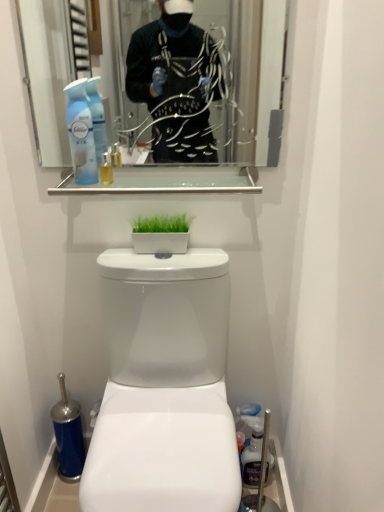
Question: Does white glossy toilet at center have a greater height compared to white glossy planter at center?

Choices:
 (A) no
 (B) yes

Answer: (B)

Question: Is white glossy toilet at center wider than white glossy planter at center?

Choices:
 (A) no
 (B) yes

Answer: (B)

Question: Is white glossy toilet at center facing away from white glossy planter at center?

Choices:
 (A) yes
 (B) no

Answer: (B)

Question: Is white glossy toilet at center placed right next to white glossy planter at center?

Choices:
 (A) yes
 (B) no

Answer: (B)

Question: Is white glossy toilet at center thinner than white glossy planter at center?

Choices:
 (A) yes
 (B) no

Answer: (B)

Question: From a real-world perspective, is clear glass shelf at upper center positioned above or below clear glass mirror at upper center?

Choices:
 (A) above
 (B) below

Answer: (B)

Question: In the image, is clear glass shelf at upper center positioned in front of or behind clear glass mirror at upper center?

Choices:
 (A) behind
 (B) front

Answer: (A)

Question: Considering the positions of point (157, 172) and point (279, 99), is point (157, 172) closer or farther from the camera than point (279, 99)?

Choices:
 (A) closer
 (B) farther

Answer: (B)

Question: Which is correct: clear glass shelf at upper center is inside clear glass mirror at upper center, or outside of it?

Choices:
 (A) inside
 (B) outside

Answer: (B)

Question: Do you think translucent plastic spray bottle at upper left is within clear glass mirror at upper center, or outside of it?

Choices:
 (A) inside
 (B) outside

Answer: (B)

Question: From a real-world perspective, is translucent plastic spray bottle at upper left positioned above or below clear glass mirror at upper center?

Choices:
 (A) below
 (B) above

Answer: (A)

Question: Does point (79, 100) appear closer or farther from the camera than point (256, 94)?

Choices:
 (A) closer
 (B) farther

Answer: (A)

Question: Based on their sizes in the image, would you say translucent plastic spray bottle at upper left is bigger or smaller than clear glass mirror at upper center?

Choices:
 (A) small
 (B) big

Answer: (A)

Question: Considering the positions of point (x=148, y=394) and point (x=178, y=4), is point (x=148, y=394) closer or farther from the camera than point (x=178, y=4)?

Choices:
 (A) farther
 (B) closer

Answer: (A)

Question: Considering the relative positions of white glossy toilet at center and clear glass mirror at upper center in the image provided, is white glossy toilet at center to the left or to the right of clear glass mirror at upper center?

Choices:
 (A) right
 (B) left

Answer: (A)